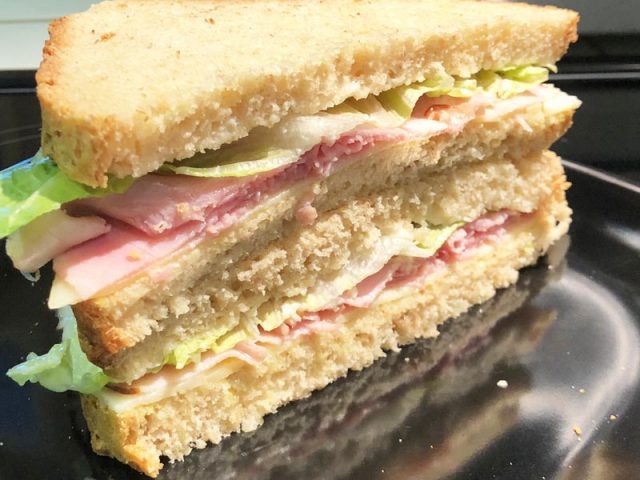
At what (x,y) coordinates should I click in order to perform the action: click on metal tray. Please return your answer as a coordinate pair (x, y). Image resolution: width=640 pixels, height=480 pixels. Looking at the image, I should click on [x=509, y=396].